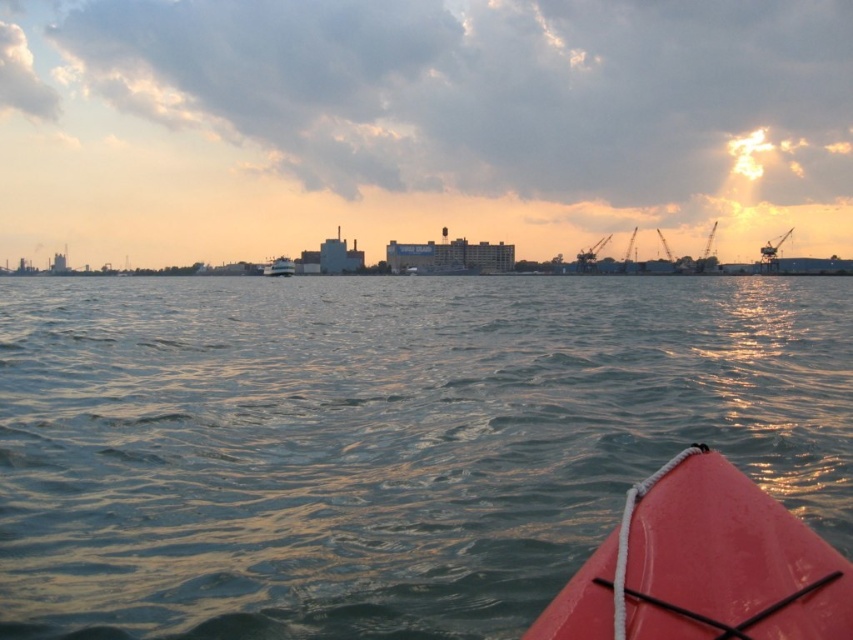
Question: Is rubberized pink kayak at lower right in front of white glossy boat at center?

Choices:
 (A) yes
 (B) no

Answer: (A)

Question: Is greenish water at center wider than rubberized pink kayak at lower right?

Choices:
 (A) yes
 (B) no

Answer: (A)

Question: Which object is closer to the camera taking this photo?

Choices:
 (A) greenish water at center
 (B) white glossy boat at center
 (C) rubberized pink kayak at lower right

Answer: (C)

Question: Which object appears farthest from the camera in this image?

Choices:
 (A) greenish water at center
 (B) rubberized pink kayak at lower right

Answer: (A)

Question: Which point is farther to the camera?

Choices:
 (A) greenish water at center
 (B) rubberized pink kayak at lower right
 (C) white glossy boat at center

Answer: (C)

Question: Can you confirm if greenish water at center is positioned below white glossy boat at center?

Choices:
 (A) no
 (B) yes

Answer: (B)